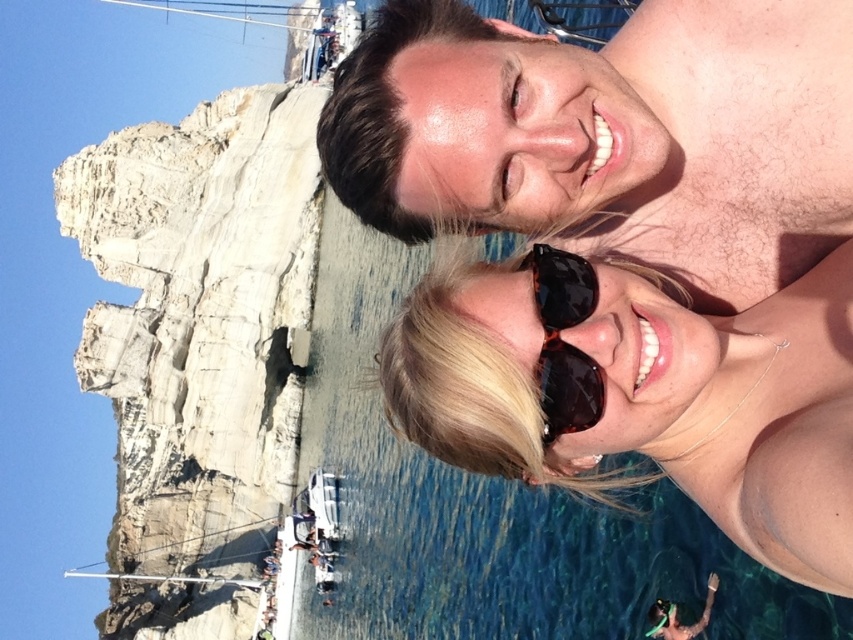
Question: Estimate the real-world distances between objects in this image. Which object is closer to the white rocky cliff at left?

Choices:
 (A) shiny skin at upper center
 (B) brown shiny sunglasses at upper center
 (C) tortoiseshell sunglasses at center

Answer: (B)

Question: Which point is closer to the camera taking this photo?

Choices:
 (A) (596, 390)
 (B) (225, 369)
 (C) (605, 451)
 (D) (764, 186)

Answer: (A)

Question: Considering the relative positions of shiny skin at upper center and brown shiny sunglasses at upper center in the image provided, where is shiny skin at upper center located with respect to brown shiny sunglasses at upper center?

Choices:
 (A) below
 (B) above

Answer: (B)

Question: Which point is closer to the camera?

Choices:
 (A) (248, 556)
 (B) (577, 392)
 (C) (577, 77)

Answer: (B)

Question: Can you confirm if shiny skin at upper center is positioned to the right of tortoiseshell sunglasses at center?

Choices:
 (A) no
 (B) yes

Answer: (B)

Question: Is white rocky cliff at left closer to the viewer compared to tortoiseshell sunglasses at center?

Choices:
 (A) no
 (B) yes

Answer: (A)